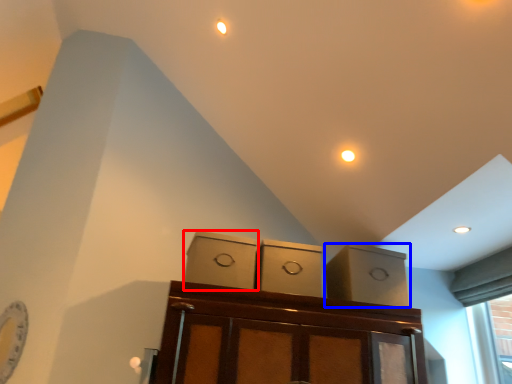
Question: Which of the following is the closest to the observer, cabinetry (highlighted by a red box) or cabinetry (highlighted by a blue box)?

Choices:
 (A) cabinetry
 (B) cabinetry

Answer: (A)